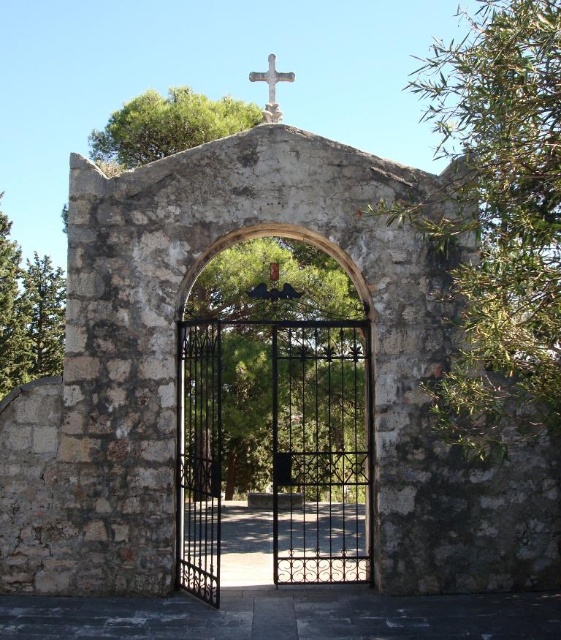
You are a visitor approaching the archway and want to enter through the gate. Based on the scene, which object is taller, the black wrought iron gate at center or the white stone cross at upper center?

The black wrought iron gate at center is much taller than the white stone cross at upper center, so the gate is taller.

You are standing at the base of the stone archway and want to place two markers at the coordinates point (200,444) and point (270,74). Which marker will be closer to the archway?

Point (270,74) is closer to the archway because point (200,444) is behind it.